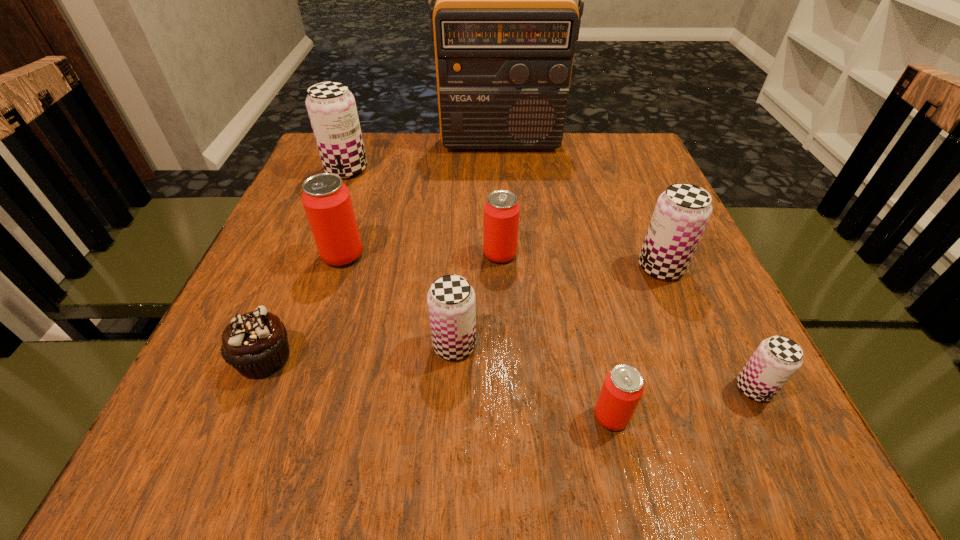
At what (x,y) coordinates should I click in order to perform the action: click on the nearest purple beer can. Please return your answer as a coordinate pair (x, y). This screenshot has width=960, height=540. Looking at the image, I should click on (776, 360).

The width and height of the screenshot is (960, 540). I want to click on the rightmost red beer can, so click(x=623, y=387).

Identify the location of the third beer can from right to left. The height and width of the screenshot is (540, 960). (623, 387).

The width and height of the screenshot is (960, 540). Identify the location of brown cupcake. (256, 344).

You are a GUI agent. You are given a task and a screenshot of the screen. Output one action in this format:
    pyautogui.click(x=<x>, y=<y>)
    Task: Click on the free space located 0.160m on the front-facing side of the radio receiver
    The image size is (960, 540).
    Given the screenshot: What is the action you would take?
    pyautogui.click(x=504, y=191)

This screenshot has width=960, height=540. What are the coordinates of `vacant region located 0.100m on the front of the farthest purple beer can` in the screenshot? It's located at (332, 206).

The image size is (960, 540). I want to click on free location located 0.300m on the back of the leftmost red beer can, so click(372, 164).

The width and height of the screenshot is (960, 540). I want to click on blank area located on the back of the second farthest purple beer can, so (637, 212).

Where is `vacant space located on the left of the second biggest red beer can`? This screenshot has width=960, height=540. vacant space located on the left of the second biggest red beer can is located at coordinates (355, 254).

You are a GUI agent. You are given a task and a screenshot of the screen. Output one action in this format:
    pyautogui.click(x=<x>, y=<y>)
    Task: Click on the free location located 0.120m on the right of the fifth farthest beer can
    Image resolution: width=960 pixels, height=540 pixels.
    Given the screenshot: What is the action you would take?
    pyautogui.click(x=551, y=345)